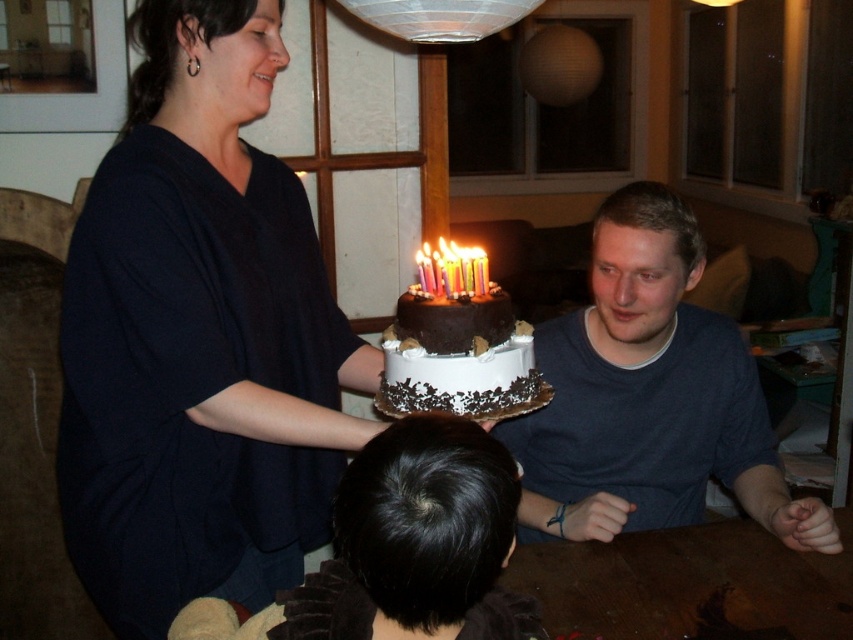
Question: Is brown wooden table at lower center further to camera compared to chocolate frosted cake at center?

Choices:
 (A) yes
 (B) no

Answer: (A)

Question: Which object is positioned closest to the matte black dress at upper left?

Choices:
 (A) chocolate frosted cake at center
 (B) matte dark blue shirt at center
 (C) brown wooden table at lower center

Answer: (A)

Question: Which is nearer to the brown wooden table at lower center?

Choices:
 (A) matte black dress at upper left
 (B) chocolate frosted cake at center
 (C) matte dark blue shirt at center

Answer: (C)

Question: Is matte black dress at upper left to the left of matte dark blue shirt at center from the viewer's perspective?

Choices:
 (A) no
 (B) yes

Answer: (B)

Question: In this image, where is matte black dress at upper left located relative to matte dark blue shirt at center?

Choices:
 (A) left
 (B) right

Answer: (A)

Question: Among these points, which one is nearest to the camera?

Choices:
 (A) (241, 524)
 (B) (666, 502)
 (C) (393, 396)
 (D) (816, 596)

Answer: (C)